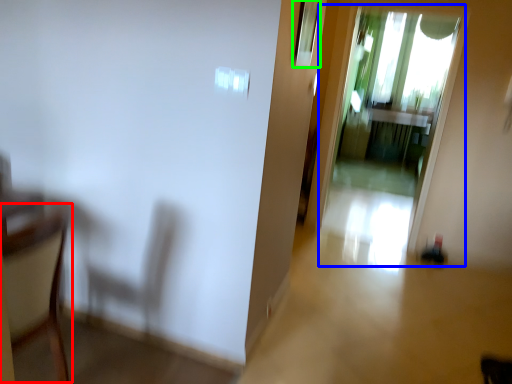
Question: Which object is the closest to the armchair (highlighted by a red box)? Choose among these: screen door (highlighted by a blue box) or window (highlighted by a green box).

Choices:
 (A) screen door
 (B) window

Answer: (B)